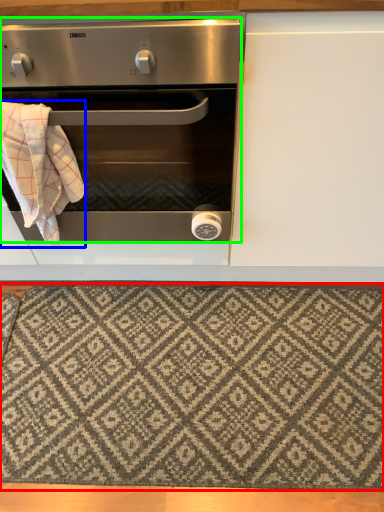
Question: Estimate the real-world distances between objects in this image. Which object is closer to mat (highlighted by a red box), blanket (highlighted by a blue box) or oven (highlighted by a green box)?

Choices:
 (A) blanket
 (B) oven

Answer: (B)